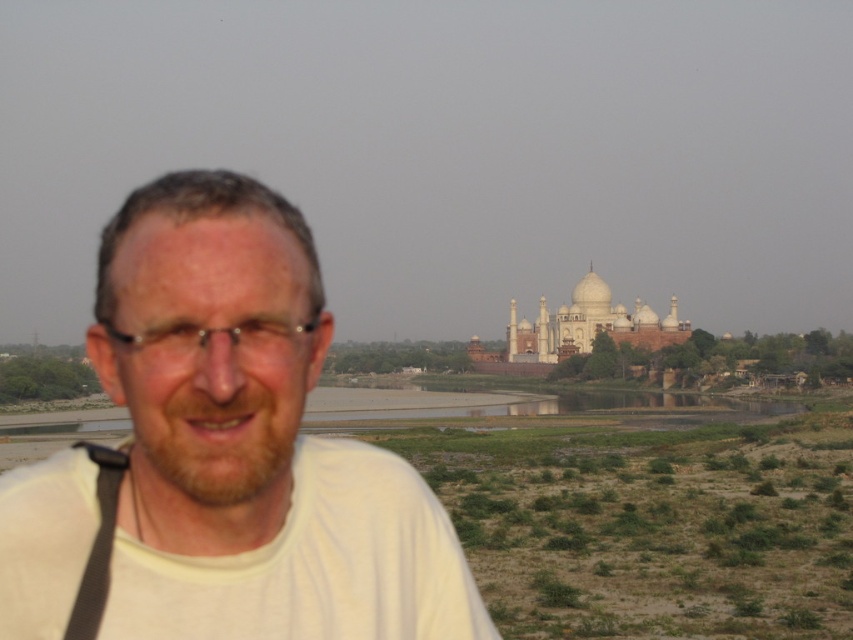
You are a photographer trying to capture the white marble palace at center while ensuring the white matte shirt at left is also in the frame. Based on their positions, will both objects be in focus simultaneously?

The white matte shirt at left is closer to the viewer than the white marble palace at center. Since they are at different distances, it may be challenging to have both in focus simultaneously unless using a very small aperture or a lens with a large depth of field.

You are a photographer standing at the edge of the dry grassy area in the foreground. You want to take a photo of the iconic white structure in the background. However, your camera is hanging on the black fabric strap at lower left, and your white matte shirt at left is in the way. Can you move your shirt out of the camera lens path without moving the camera?

The distance between the white matte shirt at left and the black fabric strap at lower left is 25.96 feet. Since the shirt is more than 25 feet away from the camera strap, you can move the shirt out of the way without disturbing the camera.